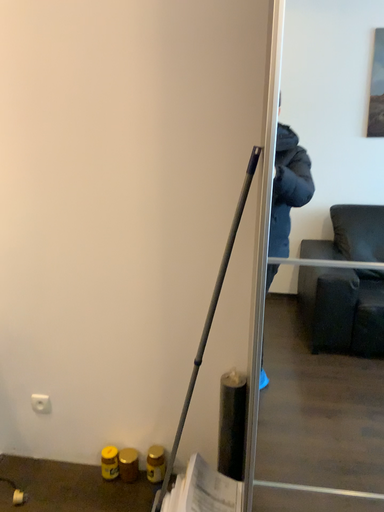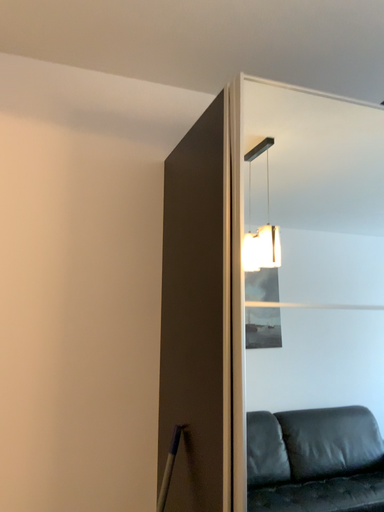
Question: How did the camera likely rotate when shooting the video?

Choices:
 (A) rotated right
 (B) rotated left

Answer: (A)